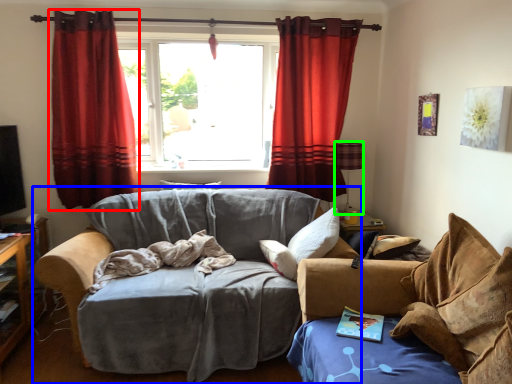
Question: Which object is positioned farthest from curtain (highlighted by a red box)? Select from studio couch (highlighted by a blue box) and lamp (highlighted by a green box).

Choices:
 (A) studio couch
 (B) lamp

Answer: (B)